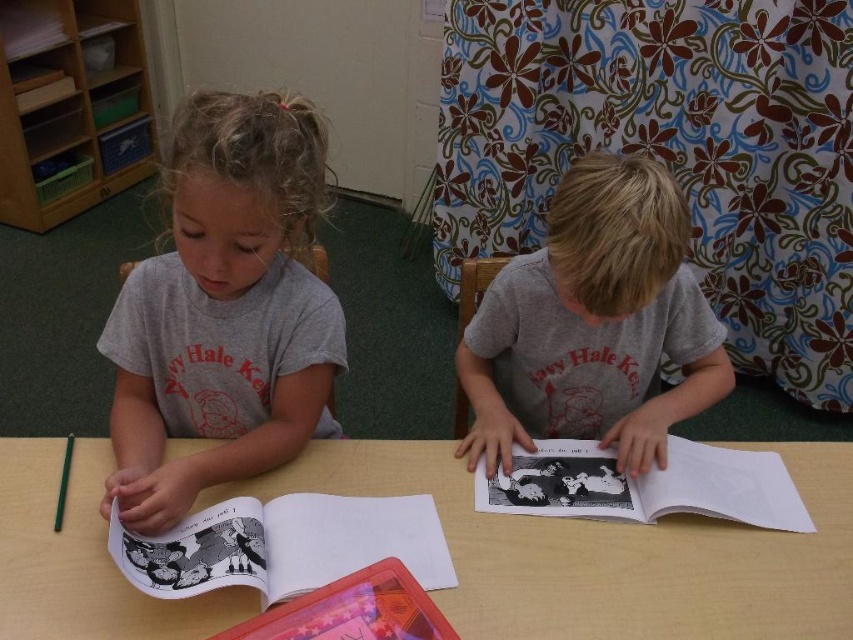
Which is behind, point (163, 380) or point (631, 365)?

The point (631, 365) is more distant.

Which of these two, gray matte shirt at left or gray matte shirt at center, stands shorter?

gray matte shirt at center is shorter.

In order to click on gray matte shirt at left in this screenshot , I will do `click(224, 310)`.

Where is `gray matte shirt at left`? Image resolution: width=853 pixels, height=640 pixels. gray matte shirt at left is located at coordinates (224, 310).

From the picture: Is wooden table at center below black paper book at center?

Indeed, wooden table at center is positioned under black paper book at center.

Is wooden table at center further to camera compared to black paper book at center?

No, it is in front of black paper book at center.

Is point (357, 451) closer to viewer compared to point (730, 508)?

No, (357, 451) is further to viewer.

This screenshot has height=640, width=853. Identify the location of wooden table at center. (608, 552).

Which is more to the right, gray matte shirt at left or black paper book at lower left?

black paper book at lower left

Who is lower down, gray matte shirt at left or black paper book at lower left?

Positioned lower is black paper book at lower left.

At what (x,y) coordinates should I click in order to perform the action: click on gray matte shirt at left. Please return your answer as a coordinate pair (x, y). Looking at the image, I should click on (224, 310).